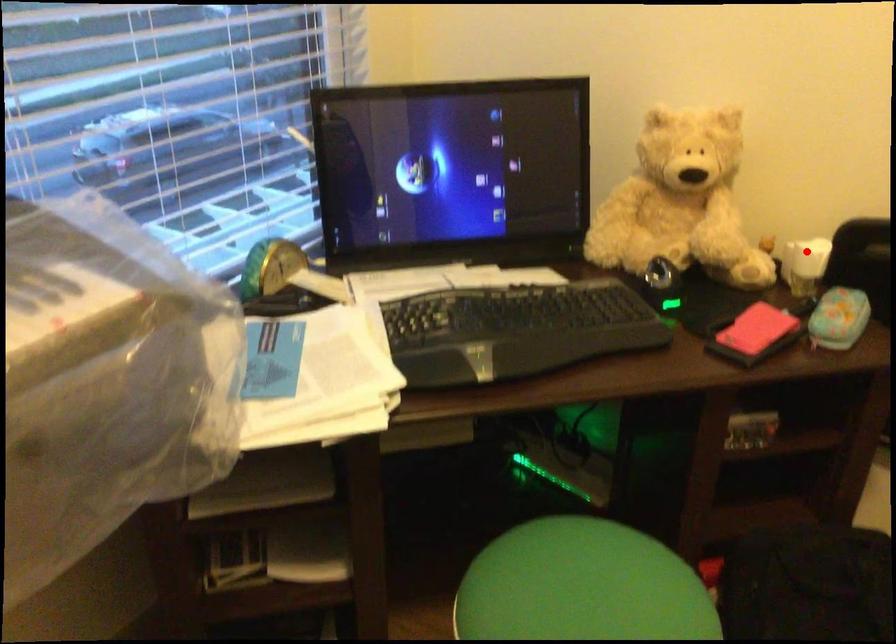
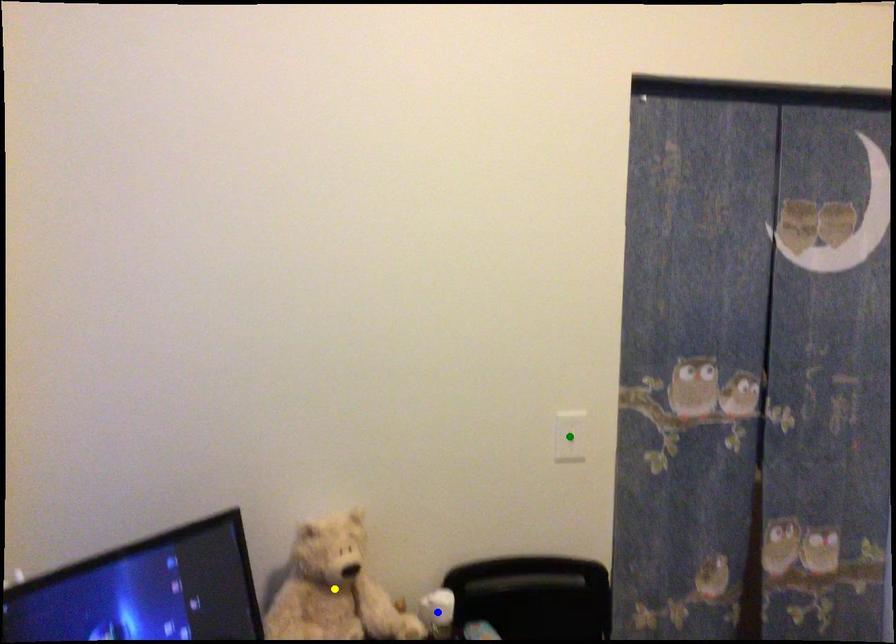
Question: I am providing you with two images of the same scene from different viewpoints. A red point is marked on the first image. You are given multiple points on the second image. Can you choose the point in image 2 that corresponds to the point in image 1?

Choices:
 (A) blue point
 (B) green point
 (C) yellow point

Answer: (A)